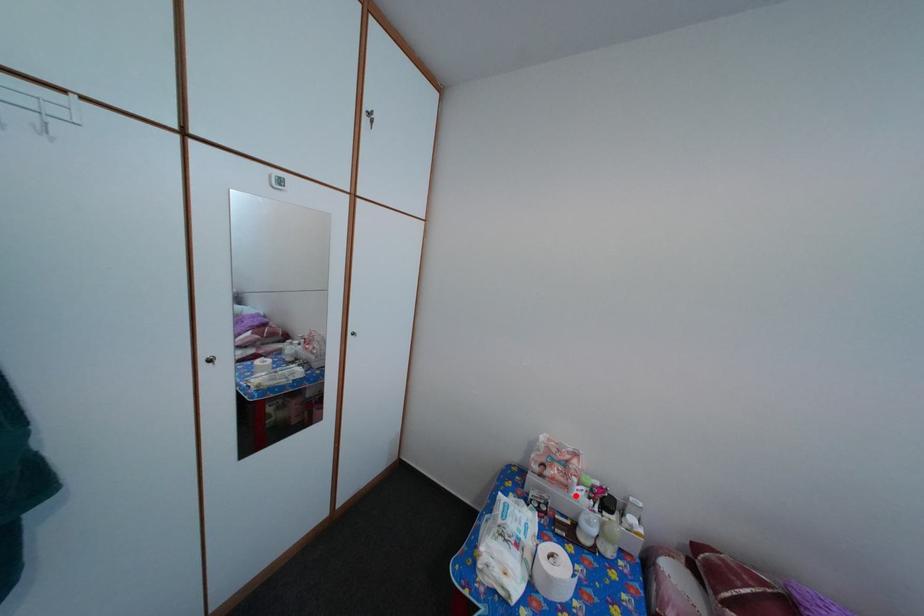
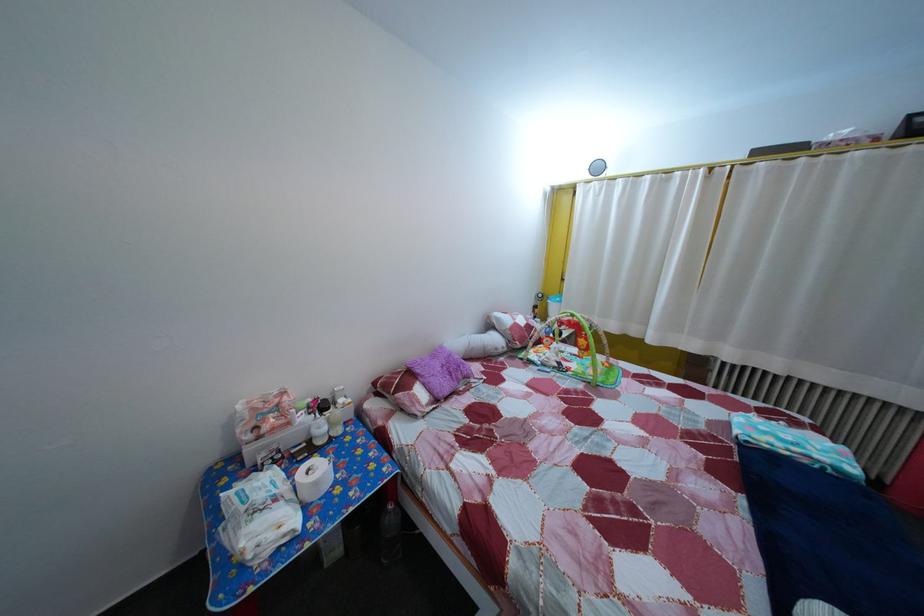
Question: I am providing you with two images of the same scene from different viewpoints. In image1, a red point is highlighted. Considering the same 3D point in image2, which of the following is correct?

Choices:
 (A) It is closer
 (B) It is farther

Answer: (A)